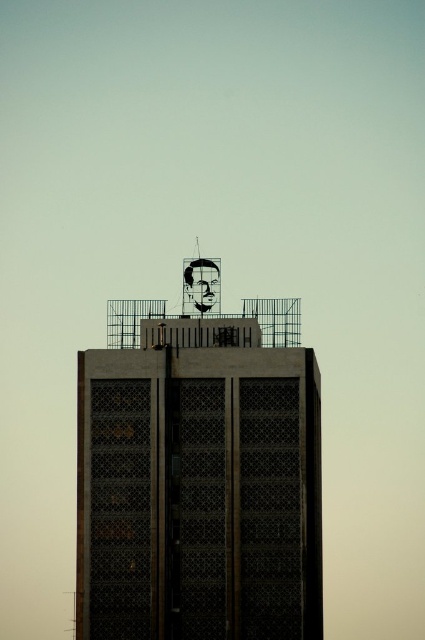
You are an architect designing a new building and want to ensure the metallic grid structure at top and matte black face at top fit within a specific width constraint. Given that the total allowable width is 10 meters, can both objects be placed side by side without exceeding the limit?

The metallic grid structure at top is wider than the matte black face at top. However, since the exact widths are not provided, it is impossible to determine if their combined width exceeds 10 meters without additional measurements.